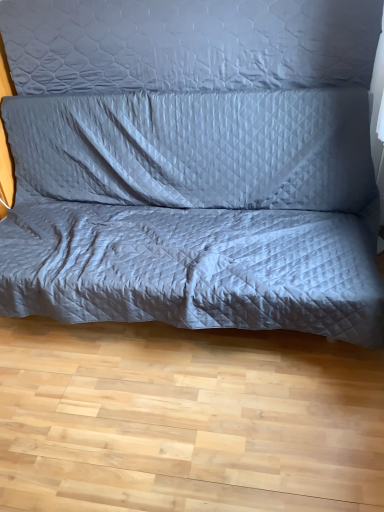
Question: Is quilted fabric couch at center wider or thinner than gray quilted pillow at upper center?

Choices:
 (A) wide
 (B) thin

Answer: (A)

Question: Considering the relative positions of quilted fabric couch at center and gray quilted pillow at upper center in the image provided, is quilted fabric couch at center to the left or to the right of gray quilted pillow at upper center?

Choices:
 (A) right
 (B) left

Answer: (B)

Question: Relative to gray quilted pillow at upper center, is quilted fabric couch at center in front or behind?

Choices:
 (A) front
 (B) behind

Answer: (A)

Question: Which is correct: gray quilted pillow at upper center is inside quilted fabric couch at center, or outside of it?

Choices:
 (A) inside
 (B) outside

Answer: (B)

Question: Looking at their shapes, would you say gray quilted pillow at upper center is wider or thinner than quilted fabric couch at center?

Choices:
 (A) wide
 (B) thin

Answer: (B)

Question: Considering their positions, is gray quilted pillow at upper center located in front of or behind quilted fabric couch at center?

Choices:
 (A) behind
 (B) front

Answer: (A)

Question: Is point (41, 42) positioned closer to the camera than point (39, 41)?

Choices:
 (A) closer
 (B) farther

Answer: (B)